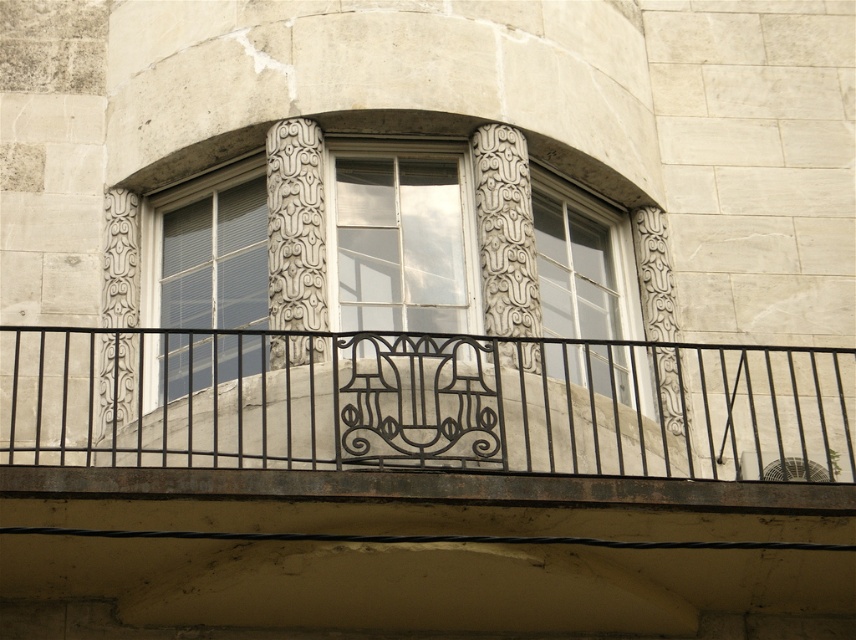
Is white glass window at center to the left of clear glass window at upper right from the viewer's perspective?

Indeed, white glass window at center is positioned on the left side of clear glass window at upper right.

Between white glass window at center and clear glass window at upper right, which one appears on the right side from the viewer's perspective?

From the viewer's perspective, clear glass window at upper right appears more on the right side.

Image resolution: width=856 pixels, height=640 pixels. In order to click on white glass window at center in this screenshot , I will do `click(211, 278)`.

At what (x,y) coordinates should I click in order to perform the action: click on white glass window at center. Please return your answer as a coordinate pair (x, y). This screenshot has width=856, height=640. Looking at the image, I should click on (211, 278).

Between point (461, 467) and point (212, 198), which one is positioned in front?

Point (461, 467) is more forward.

At what (x,y) coordinates should I click in order to perform the action: click on black wrought iron balcony at center. Please return your answer as a coordinate pair (x, y). The height and width of the screenshot is (640, 856). Looking at the image, I should click on (425, 403).

Where is `black wrought iron balcony at center`? black wrought iron balcony at center is located at coordinates (425, 403).

Can you confirm if black wrought iron balcony at center is taller than clear glass window at upper right?

Correct, black wrought iron balcony at center is much taller as clear glass window at upper right.

Does point (76, 376) lie behind point (639, 349)?

That is False.

Measure the distance between point (431, 408) and camera.

The distance of point (431, 408) from camera is 40.89 meters.

Locate an element on the screen. The width and height of the screenshot is (856, 640). black wrought iron balcony at center is located at coordinates (425, 403).